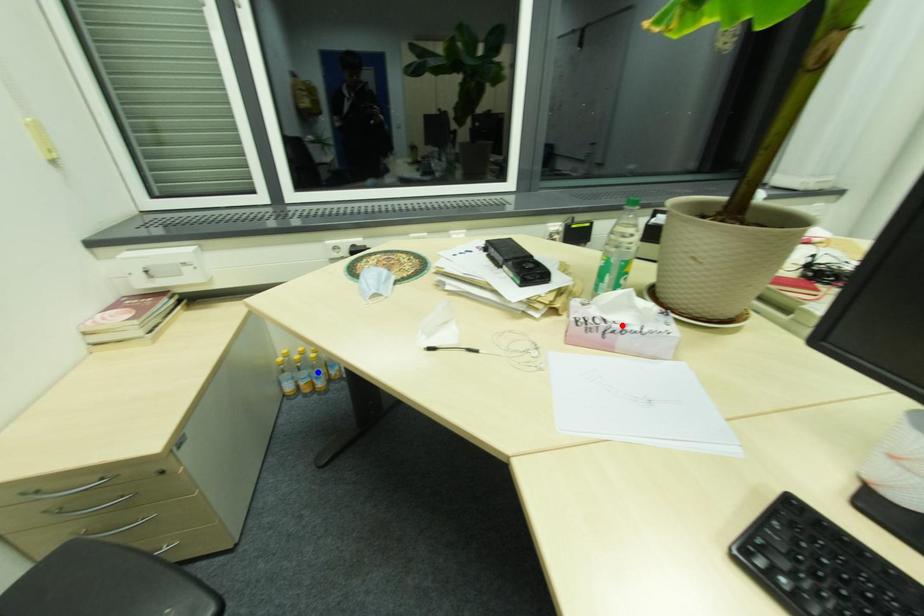
Question: In the image, two points are highlighted. Which point is nearer to the camera? Reply with the corresponding letter.

Choices:
 (A) blue point
 (B) red point

Answer: (B)